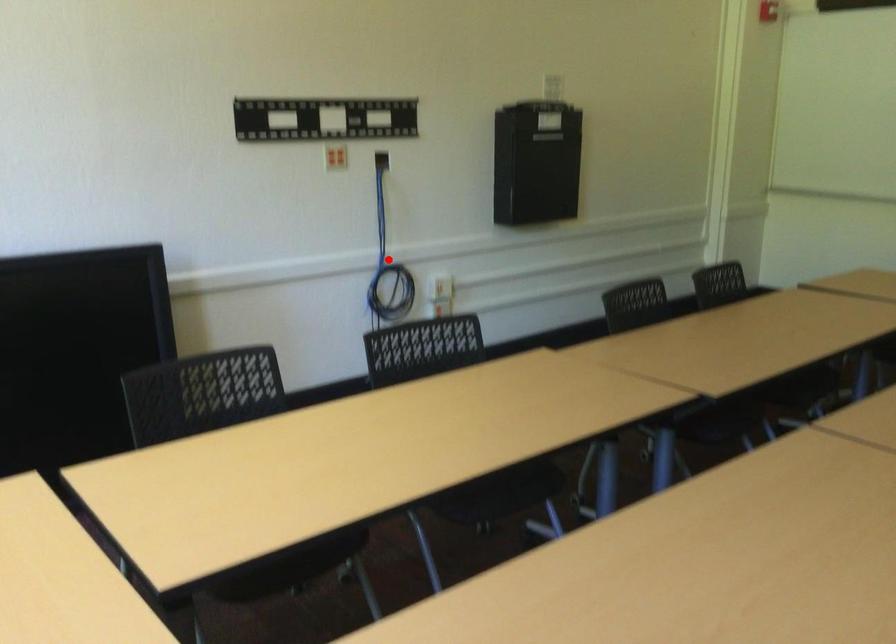
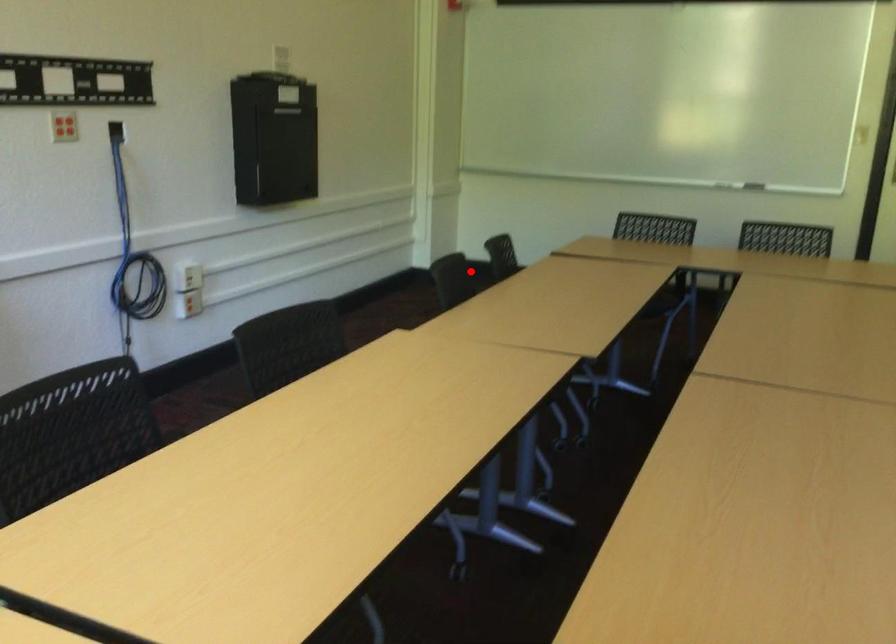
I am providing you with two images of the same scene from different viewpoints. A red point is marked on the first image and another point is marked on the second image. Is the marked point in image1 the same physical position as the marked point in image2?

→ No